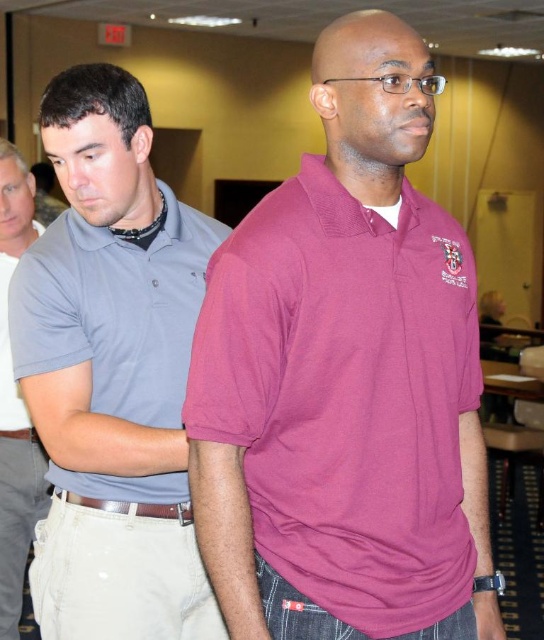
You are an observer in the room. There are two men wearing gray shirts. The first is wearing a matte gray shirt at left and the second is wearing a matte gray polo at center. Which man is positioned more to the left side of the room?

The matte gray shirt at left is positioned more to the left side of the room compared to the matte gray polo at center.

You are an observer in the conference room. You notice two men wearing gray shirts. The first is the matte gray polo shirt at left and the second is the matte gray shirt at left. Which one is closer to you?

The matte gray polo shirt at left is closer to you because it is in front of the matte gray shirt at left.